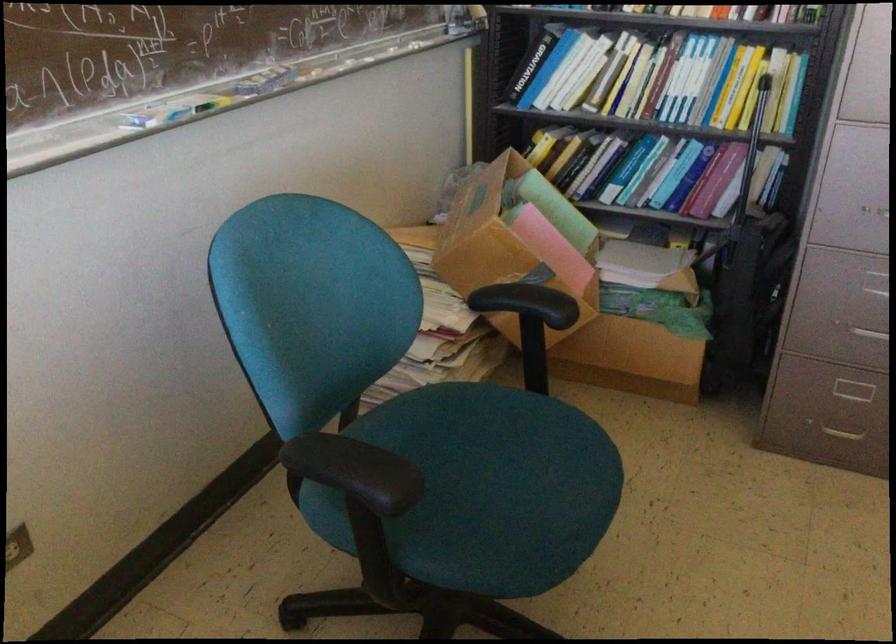
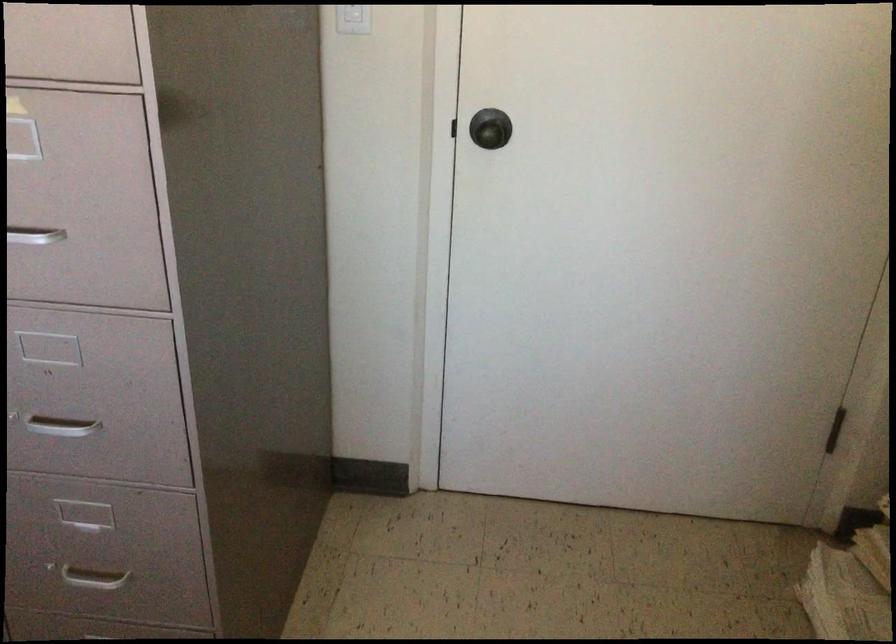
What movement of the cameraman would produce the second image?

The cameraman walked toward right, forward.